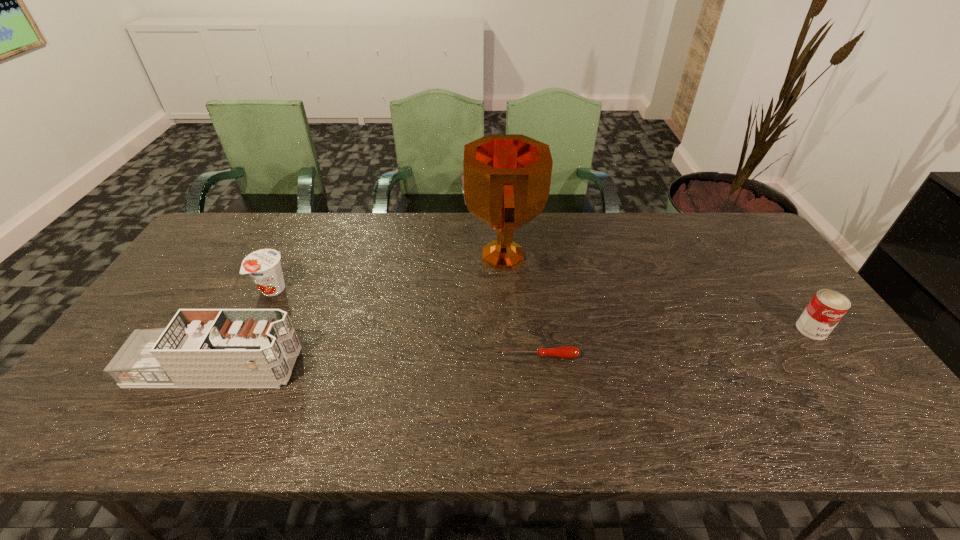
Where is `vacant area located 0.120m on the front label of the third farthest object`? The image size is (960, 540). vacant area located 0.120m on the front label of the third farthest object is located at coordinates (848, 379).

This screenshot has height=540, width=960. Find the location of `vacant space located 0.150m on the back of the yogurt`. vacant space located 0.150m on the back of the yogurt is located at coordinates (295, 246).

Identify the location of free spot located 0.220m on the right of the screwdriver. Image resolution: width=960 pixels, height=540 pixels. (665, 356).

Where is `object located at the far edge`? object located at the far edge is located at coordinates (506, 181).

What are the coordinates of `object that is at the left edge` in the screenshot? It's located at (211, 348).

Where is `object at the right edge`? object at the right edge is located at coordinates (827, 307).

Locate an element on the screen. Image resolution: width=960 pixels, height=540 pixels. vacant area at the far edge is located at coordinates (462, 227).

Find the location of a particular element. This screenshot has height=540, width=960. vacant space at the right edge of the desktop is located at coordinates (746, 263).

Where is `vacant space at the far left corner of the desktop`? This screenshot has height=540, width=960. vacant space at the far left corner of the desktop is located at coordinates [x=225, y=238].

Image resolution: width=960 pixels, height=540 pixels. Identify the location of free spot at the far right corner of the desktop. (726, 230).